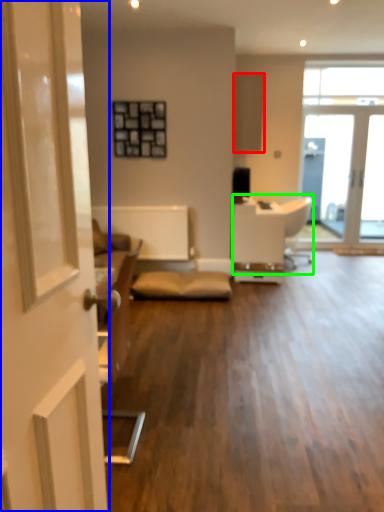
Question: Which object is positioned closest to cabinetry (highlighted by a red box)? Select from door (highlighted by a blue box) and armchair (highlighted by a green box).

Choices:
 (A) door
 (B) armchair

Answer: (B)